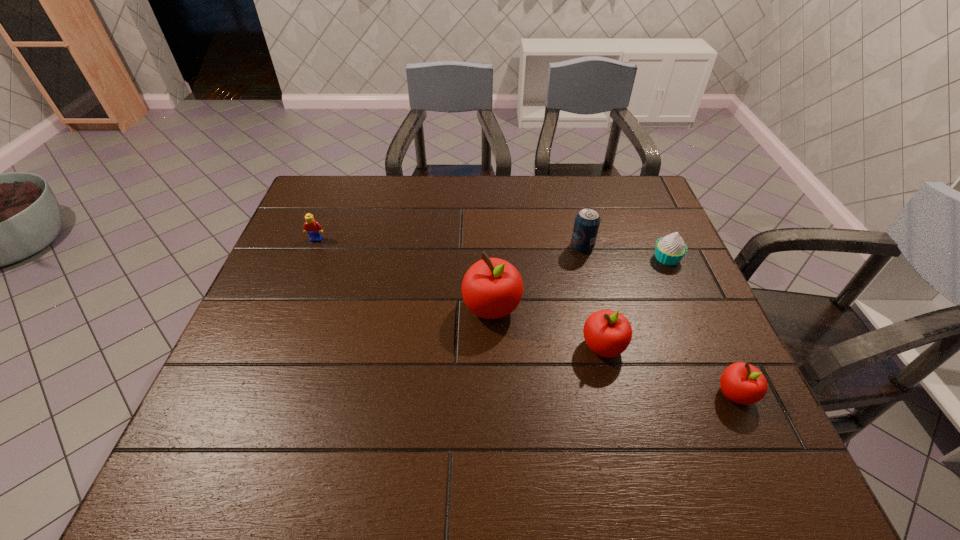
You are a GUI agent. You are given a task and a screenshot of the screen. Output one action in this format:
    pyautogui.click(x=<x>, y=<y>)
    Task: Click on the free space between the tallest object and the second apple from right to left
    The height and width of the screenshot is (540, 960).
    Given the screenshot: What is the action you would take?
    pyautogui.click(x=547, y=327)

Image resolution: width=960 pixels, height=540 pixels. I want to click on free spot between the shortest apple and the Lego, so click(526, 316).

What are the coordinates of `vacant area that lies between the leftmost object and the second object from left to right` in the screenshot? It's located at (404, 273).

At what (x,y) coordinates should I click in order to perform the action: click on vacant space that's between the pop soda and the shortest apple. Please return your answer as a coordinate pair (x, y). Looking at the image, I should click on (659, 320).

You are a GUI agent. You are given a task and a screenshot of the screen. Output one action in this format:
    pyautogui.click(x=<x>, y=<y>)
    Task: Click on the second closest object to the second apple from left to right
    The image size is (960, 540).
    Given the screenshot: What is the action you would take?
    pyautogui.click(x=742, y=383)

Locate which object ranks fifth in proximity to the second shortest apple. Please provide its 2D coordinates. Your answer should be formatted as a tuple, i.e. [(x, y)], where the tuple contains the x and y coordinates of a point satisfying the conditions above.

[(313, 228)]

Where is `the closest apple to the tallest object`? This screenshot has height=540, width=960. the closest apple to the tallest object is located at coordinates (608, 333).

Identify which apple is located as the nearest to the tallest apple. Please provide its 2D coordinates. Your answer should be formatted as a tuple, i.e. [(x, y)], where the tuple contains the x and y coordinates of a point satisfying the conditions above.

[(608, 333)]

Find the location of a particular element. Image resolution: width=960 pixels, height=540 pixels. vacant region that satisfies the following two spatial constraints: 1. on the front-facing side of the leftmost apple; 2. on the left side of the leftmost object is located at coordinates (289, 307).

At what (x,y) coordinates should I click in order to perform the action: click on free region that satisfies the following two spatial constraints: 1. on the front-facing side of the Lego; 2. on the left side of the tallest apple. Please return your answer as a coordinate pair (x, y). The width and height of the screenshot is (960, 540). Looking at the image, I should click on (289, 307).